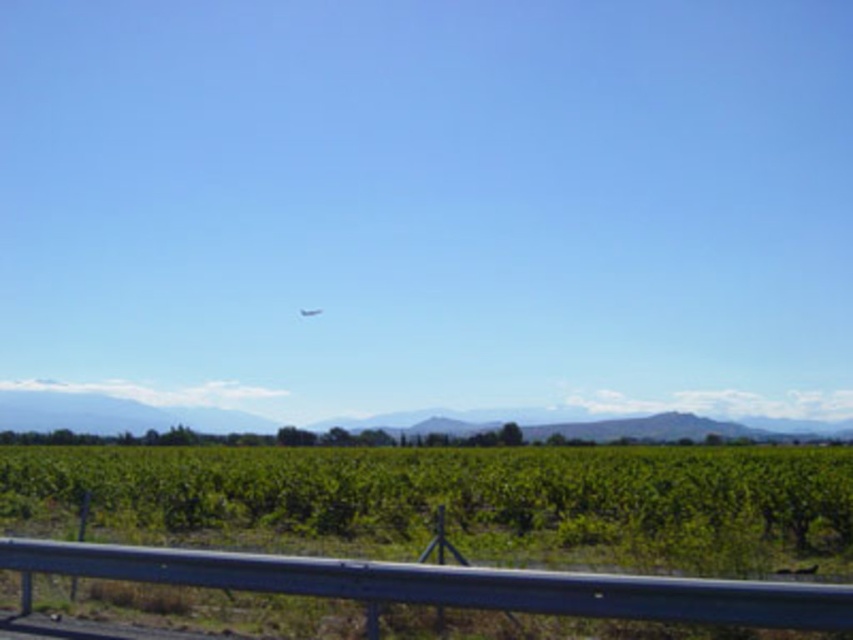
Is green leafy vineyard at lower center wider than transparent glass plane at center?

Yes, green leafy vineyard at lower center is wider than transparent glass plane at center.

Between green leafy vineyard at lower center and transparent glass plane at center, which one is positioned higher?

transparent glass plane at center is higher up.

This screenshot has height=640, width=853. What are the coordinates of `green leafy vineyard at lower center` in the screenshot? It's located at (466, 500).

What are the coordinates of `green leafy vineyard at lower center` in the screenshot? It's located at (466, 500).